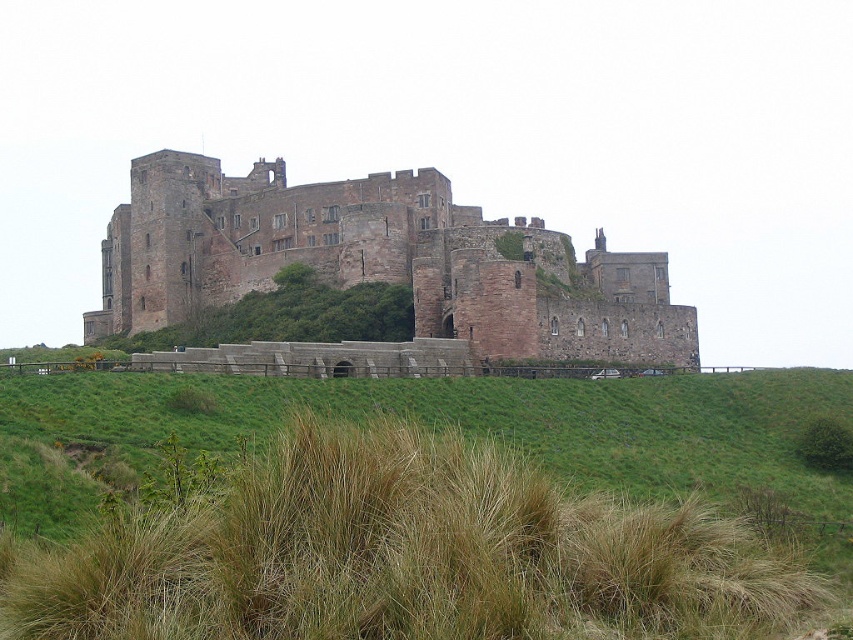
You are standing at the point labeled as point (381, 262) in the image. What structure is directly beneath your feet?

The structure directly beneath your feet at point (381, 262) is the brown stone castle at center.

You are standing on the hill looking at Bamburgh Castle. You see the brown stone castle at center and the green grass at lower center. Which object is positioned to the left of the other?

The brown stone castle at center is to the left of green grass at lower center.

You are a tourist standing at the base of the hill looking up at Bamburgh Castle. You notice the brown stone castle at center and the green grass at lower center. Which object appears wider in the image?

The brown stone castle at center appears wider than the green grass at lower center because its width surpasses the grass area.